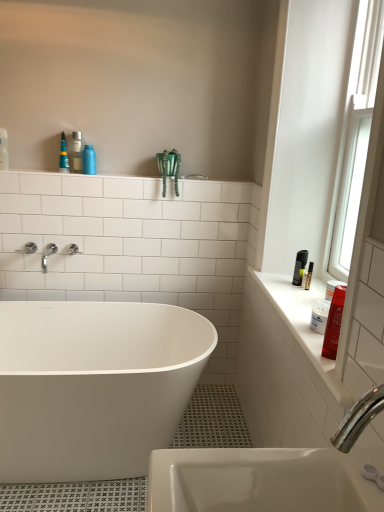
Question: Is white glossy counter top at right bigger than shiny red plastic bottle at right, which is counted as the first toiletry, starting from the right?

Choices:
 (A) no
 (B) yes

Answer: (B)

Question: Is white glossy counter top at right taller than shiny red plastic bottle at right, which is counted as the first toiletry, starting from the right?

Choices:
 (A) no
 (B) yes

Answer: (A)

Question: Can you confirm if white glossy counter top at right is smaller than shiny red plastic bottle at right, which is counted as the first toiletry, starting from the right?

Choices:
 (A) no
 (B) yes

Answer: (A)

Question: Is white glossy counter top at right positioned beyond the bounds of shiny red plastic bottle at right, positioned as the second toiletry in left-to-right order?

Choices:
 (A) no
 (B) yes

Answer: (B)

Question: Can you confirm if white glossy counter top at right is wider than shiny red plastic bottle at right, the 1th toiletry from the bottom?

Choices:
 (A) yes
 (B) no

Answer: (A)

Question: From the image's perspective, is white glossy bathtub at center positioned above or below blue plastic bottle at upper center, acting as the 2th toiletry starting from the front?

Choices:
 (A) above
 (B) below

Answer: (B)

Question: Is white glossy bathtub at center taller or shorter than blue plastic bottle at upper center, acting as the 2th toiletry starting from the front?

Choices:
 (A) tall
 (B) short

Answer: (A)

Question: From a real-world perspective, is white glossy bathtub at center above or below blue plastic bottle at upper center, which is the first toiletry in left-to-right order?

Choices:
 (A) above
 (B) below

Answer: (B)

Question: Is white glossy bathtub at center inside or outside of blue plastic bottle at upper center, acting as the 2th toiletry starting from the front?

Choices:
 (A) outside
 (B) inside

Answer: (A)

Question: Is shiny red plastic bottle at right, the 2th toiletry in the back-to-front sequence, in front of or behind blue plastic bottle at upper center, which is the first toiletry in left-to-right order, in the image?

Choices:
 (A) front
 (B) behind

Answer: (A)

Question: Is point (331, 346) positioned closer to the camera than point (92, 173)?

Choices:
 (A) closer
 (B) farther

Answer: (A)

Question: From the image's perspective, is shiny red plastic bottle at right, which is counted as the first toiletry, starting from the right, located above or below blue plastic bottle at upper center, the first toiletry in the top-to-bottom sequence?

Choices:
 (A) above
 (B) below

Answer: (B)

Question: Considering the positions of shiny red plastic bottle at right, the 1th toiletry from the bottom, and blue plastic bottle at upper center, positioned as the 1th toiletry in back-to-front order, in the image, is shiny red plastic bottle at right, the 1th toiletry from the bottom, bigger or smaller than blue plastic bottle at upper center, positioned as the 1th toiletry in back-to-front order,?

Choices:
 (A) small
 (B) big

Answer: (B)

Question: Considering the relative positions of shiny red plastic bottle at right, the first toiletry in the front-to-back sequence, and white glossy bathtub at center in the image provided, is shiny red plastic bottle at right, the first toiletry in the front-to-back sequence, to the left or to the right of white glossy bathtub at center?

Choices:
 (A) left
 (B) right

Answer: (B)

Question: Based on their sizes in the image, would you say shiny red plastic bottle at right, which is counted as the first toiletry, starting from the right, is bigger or smaller than white glossy bathtub at center?

Choices:
 (A) small
 (B) big

Answer: (A)